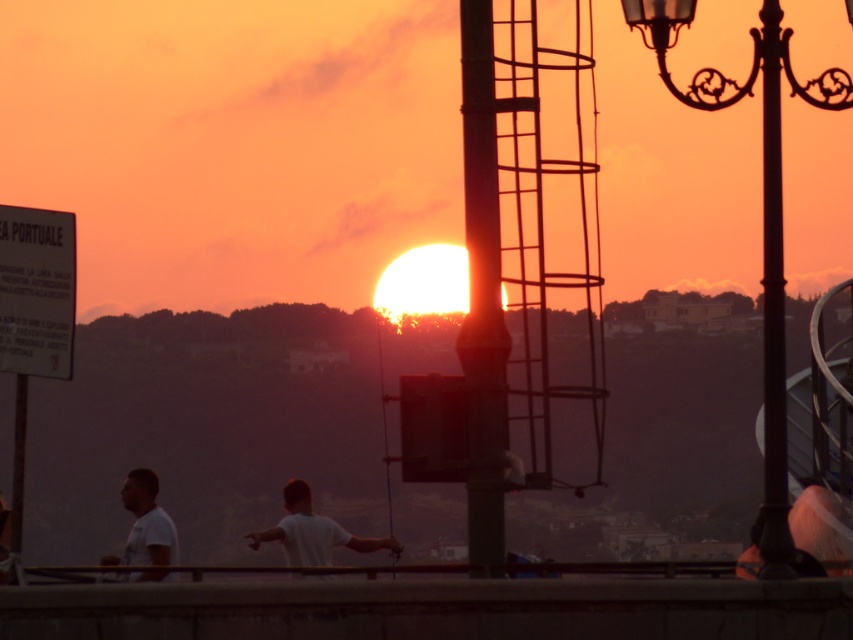
Who is taller, black wrought iron lamp post at upper right or white cotton t-shirt at center?

With more height is black wrought iron lamp post at upper right.

Which is more to the right, black wrought iron lamp post at upper right or white cotton t-shirt at center?

black wrought iron lamp post at upper right

Consider the image. Who is more forward, (766, 497) or (152, 480)?

Point (766, 497)

Identify the location of black wrought iron lamp post at upper right. The image size is (853, 640). (763, 218).

Can you confirm if black metal pole at right is positioned to the right of white matte shirt at center?

Correct, you'll find black metal pole at right to the right of white matte shirt at center.

Find the location of a particular element. black metal pole at right is located at coordinates (773, 307).

Locate an element on the screen. black metal pole at right is located at coordinates (773, 307).

Is point (485, 444) more distant than point (775, 134)?

Yes, point (485, 444) is farther from viewer.

Based on the photo, is metallic ladder at center shorter than black metal pole at right?

Incorrect, metallic ladder at center's height does not fall short of black metal pole at right's.

The image size is (853, 640). Identify the location of metallic ladder at center. (482, 296).